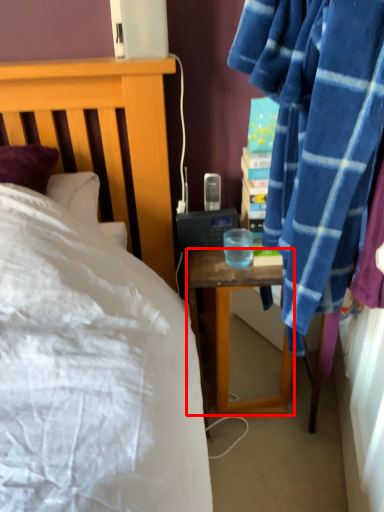
Question: From the image, what is the correct spatial relationship of desk (annotated by the red box) in relation to coffee cup?

Choices:
 (A) left
 (B) right

Answer: (B)